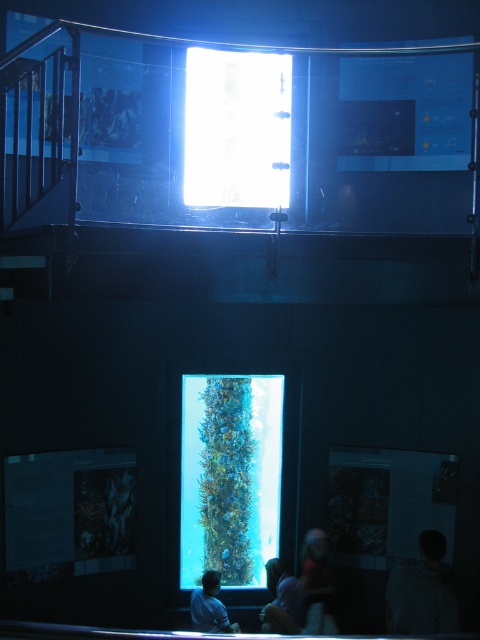
Between dark gray sweater at lower right and light blue fabric shirt at lower center, which one has more height?

Standing taller between the two is dark gray sweater at lower right.

Is point (404, 579) positioned in front of point (203, 586)?

That is True.

Image resolution: width=480 pixels, height=640 pixels. I want to click on dark gray sweater at lower right, so click(x=421, y=593).

Between smooth skin face at lower right and light blue fabric at lower center, which one has less height?

Standing shorter between the two is light blue fabric at lower center.

The width and height of the screenshot is (480, 640). Describe the element at coordinates (316, 586) in the screenshot. I see `smooth skin face at lower right` at that location.

You are a GUI agent. You are given a task and a screenshot of the screen. Output one action in this format:
    pyautogui.click(x=<x>, y=<y>)
    Task: Click on the smooth skin face at lower right
    
    Given the screenshot: What is the action you would take?
    pyautogui.click(x=316, y=586)

This screenshot has height=640, width=480. Find the location of `smooth skin face at lower right`. smooth skin face at lower right is located at coordinates (316, 586).

Is the position of dark gray sweater at lower right less distant than that of light blue fabric at lower center?

That is True.

Is point (446, 620) positioned after point (282, 632)?

No, (446, 620) is closer to viewer.

Where is `dark gray sweater at lower right`? Image resolution: width=480 pixels, height=640 pixels. dark gray sweater at lower right is located at coordinates (421, 593).

This screenshot has width=480, height=640. I want to click on dark gray sweater at lower right, so click(421, 593).